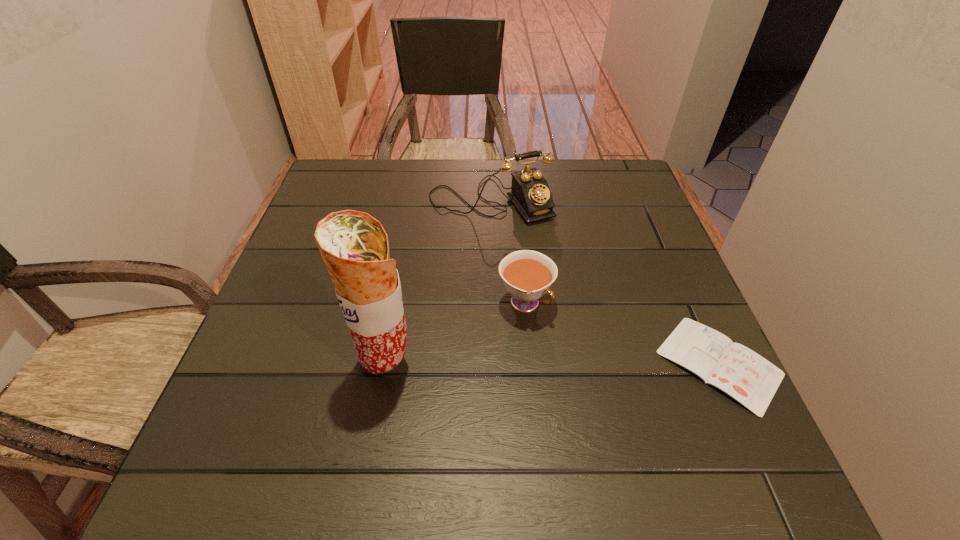
This screenshot has width=960, height=540. I want to click on free space on the desktop that is between the burrito and the rightmost object and is positioned on the dial of the farthest object, so click(595, 363).

Find the location of `free space on the desktop that is between the tallest object and the shortest object and is positioned on the side of the third tallest object with the handle`. free space on the desktop that is between the tallest object and the shortest object and is positioned on the side of the third tallest object with the handle is located at coordinates (600, 363).